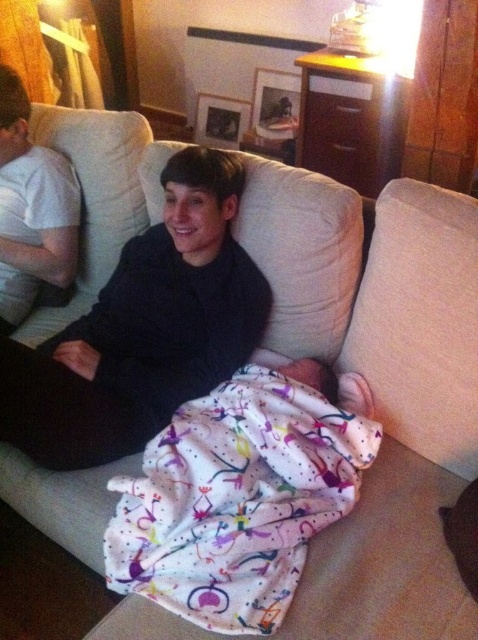
You are a delivery person who needs to place a small package between the beige fabric pillow at right and the matte black sweater at left. The package is 1.5 feet long. Is there enough space between them to fit the package?

The beige fabric pillow at right and matte black sweater at left are 3.30 feet apart from each other. Since the package is 1.5 feet long, there is sufficient space between them to fit the package.